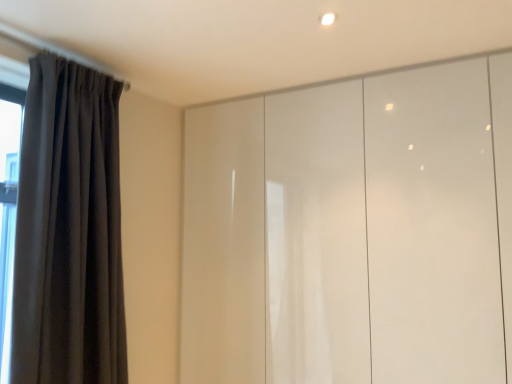
I want to click on glossy white cupboard at center, so click(x=352, y=231).

The width and height of the screenshot is (512, 384). What do you see at coordinates (352, 231) in the screenshot? I see `glossy white cupboard at center` at bounding box center [352, 231].

Identify the location of dark grey velvet curtain at left. This screenshot has width=512, height=384. (69, 230).

Measure the distance between point (83, 239) and camera.

A distance of 5.25 feet exists between point (83, 239) and camera.

Describe the element at coordinates (69, 230) in the screenshot. I see `dark grey velvet curtain at left` at that location.

I want to click on glossy white cupboard at center, so click(352, 231).

Can you confirm if dark grey velvet curtain at left is positioned to the left of glossy white cupboard at center?

Yes.

Which object is closer to the camera taking this photo, dark grey velvet curtain at left or glossy white cupboard at center?

dark grey velvet curtain at left is more forward.

Is point (37, 113) closer or farther from the camera than point (254, 284)?

Point (37, 113).

From the image's perspective, is dark grey velvet curtain at left below glossy white cupboard at center?

No, from the image's perspective, dark grey velvet curtain at left is not below glossy white cupboard at center.

From a real-world perspective, is dark grey velvet curtain at left on top of glossy white cupboard at center?

Yes, from a real-world perspective, dark grey velvet curtain at left is above glossy white cupboard at center.

Between dark grey velvet curtain at left and glossy white cupboard at center, which one has larger width?

glossy white cupboard at center.

In terms of height, does dark grey velvet curtain at left look taller or shorter compared to glossy white cupboard at center?

Considering their sizes, dark grey velvet curtain at left has less height than glossy white cupboard at center.

Consider the image. In terms of size, does dark grey velvet curtain at left appear bigger or smaller than glossy white cupboard at center?

Clearly, dark grey velvet curtain at left is smaller in size than glossy white cupboard at center.

In the scene shown: Can glossy white cupboard at center be found inside dark grey velvet curtain at left?

That's incorrect, glossy white cupboard at center is not inside dark grey velvet curtain at left.

Is dark grey velvet curtain at left positioned far away from glossy white cupboard at center?

No, dark grey velvet curtain at left is not far away from glossy white cupboard at center.

Is dark grey velvet curtain at left aimed at glossy white cupboard at center?

No, dark grey velvet curtain at left is not turned towards glossy white cupboard at center.

How many degrees apart are the facing directions of dark grey velvet curtain at left and glossy white cupboard at center?

dark grey velvet curtain at left and glossy white cupboard at center are facing 91.8 degrees away from each other.

Where is `curtain above the glossy white cupboard at center (from a real-world perspective)`? curtain above the glossy white cupboard at center (from a real-world perspective) is located at coordinates (69, 230).

Is glossy white cupboard at center to the right of dark grey velvet curtain at left from the viewer's perspective?

Yes.

Is glossy white cupboard at center positioned behind dark grey velvet curtain at left?

Yes.

Which point is more distant from viewer, (473, 232) or (113, 237)?

The point (113, 237) is farther.

From the image's perspective, which object appears higher, glossy white cupboard at center or dark grey velvet curtain at left?

dark grey velvet curtain at left, from the image's perspective.

From a real-world perspective, is glossy white cupboard at center located higher than dark grey velvet curtain at left?

No.

Which of these two, glossy white cupboard at center or dark grey velvet curtain at left, is thinner?

Thinner between the two is dark grey velvet curtain at left.

Is glossy white cupboard at center taller or shorter than dark grey velvet curtain at left?

Considering their sizes, glossy white cupboard at center has more height than dark grey velvet curtain at left.

Between glossy white cupboard at center and dark grey velvet curtain at left, which one has smaller size?

dark grey velvet curtain at left.

Could dark grey velvet curtain at left be considered to be inside glossy white cupboard at center?

No.

Is glossy white cupboard at center next to dark grey velvet curtain at left?

No, glossy white cupboard at center is not with dark grey velvet curtain at left.

Could you tell me if glossy white cupboard at center is turned towards dark grey velvet curtain at left?

Yes, glossy white cupboard at center is aimed at dark grey velvet curtain at left.

This screenshot has height=384, width=512. Find the location of `cupboard on the right of dark grey velvet curtain at left`. cupboard on the right of dark grey velvet curtain at left is located at coordinates (x=352, y=231).

Find the location of a particular element. This screenshot has height=384, width=512. curtain that is above the glossy white cupboard at center (from a real-world perspective) is located at coordinates (69, 230).

Identify the location of cupboard lying behind the dark grey velvet curtain at left. (352, 231).